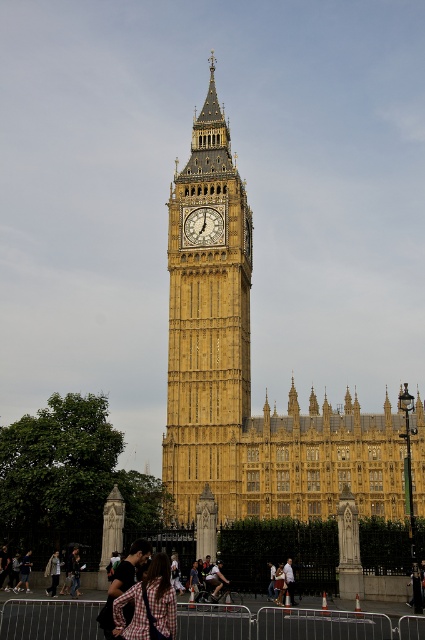
Does gold textured clock at center have a smaller size compared to light brown leather jacket at lower left?

No.

Who is taller, gold textured clock at center or light brown leather jacket at lower left?

With more height is gold textured clock at center.

Locate an element on the screen. The height and width of the screenshot is (640, 425). gold textured clock at center is located at coordinates (203, 225).

How much distance is there between plaid fabric backpack at lower center and light brown leather jacket at lower left?

plaid fabric backpack at lower center is 22.58 meters from light brown leather jacket at lower left.

I want to click on plaid fabric backpack at lower center, so click(149, 604).

Who is more forward, (175, 628) or (59, 577)?

Point (175, 628)

The image size is (425, 640). What are the coordinates of `plaid fabric backpack at lower center` in the screenshot? It's located at (149, 604).

Who is positioned more to the right, light brown leather jacket at lower left or light brown leather jacket at center?

Positioned to the right is light brown leather jacket at center.

Which is behind, point (51, 580) or point (286, 564)?

The point (51, 580) is behind.

Where is `light brown leather jacket at lower left`? This screenshot has width=425, height=640. light brown leather jacket at lower left is located at coordinates (53, 572).